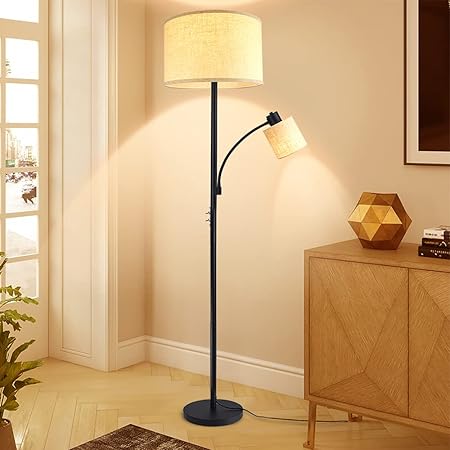
Identify the location of floor. (147, 399).